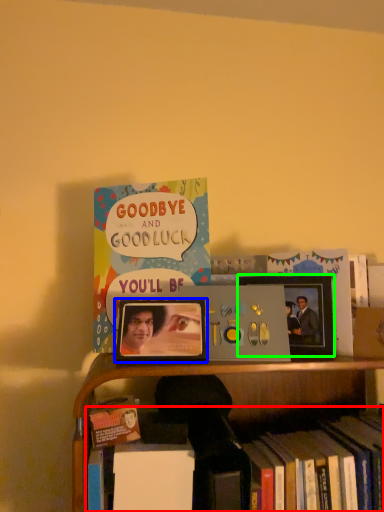
Question: Which object is the closest to the book (highlighted by a red box)? Choose among these: picture frame (highlighted by a blue box) or picture frame (highlighted by a green box).

Choices:
 (A) picture frame
 (B) picture frame

Answer: (A)